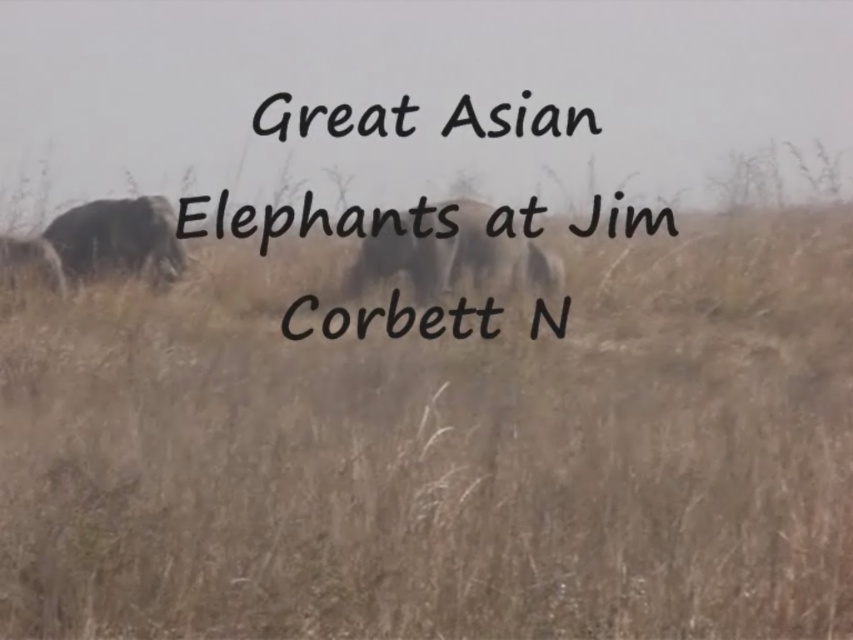
You are a wildlife photographer trying to capture a closeup shot of the gray textured elephant at left. Given that your telephoto lens can focus on subjects within 10 meters, will you be able to get a clear closeup without moving closer?

The gray textured elephant at left is 12.21 meters from the camera, which is beyond the 10 meter focusing range of your telephoto lens. You will not be able to get a clear closeup without moving closer.